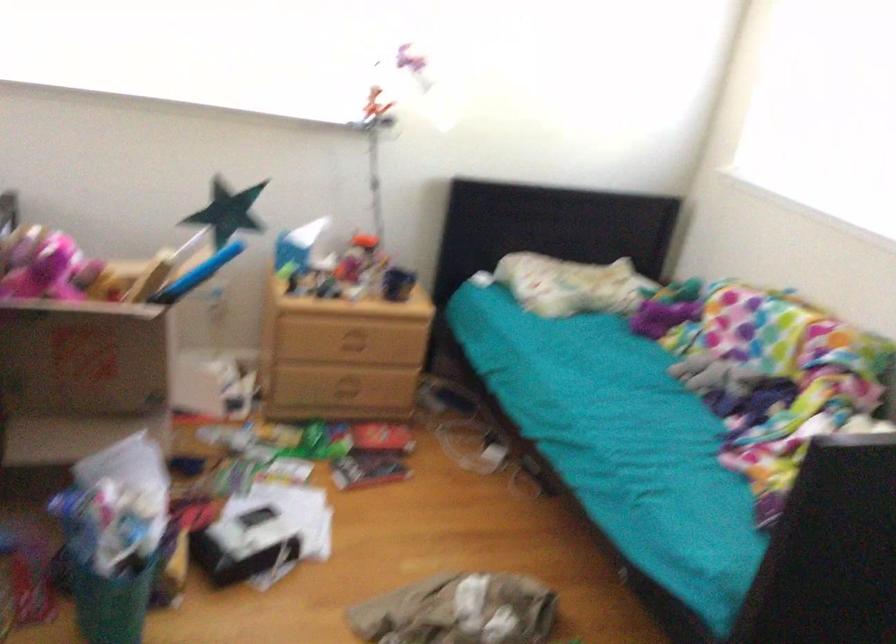
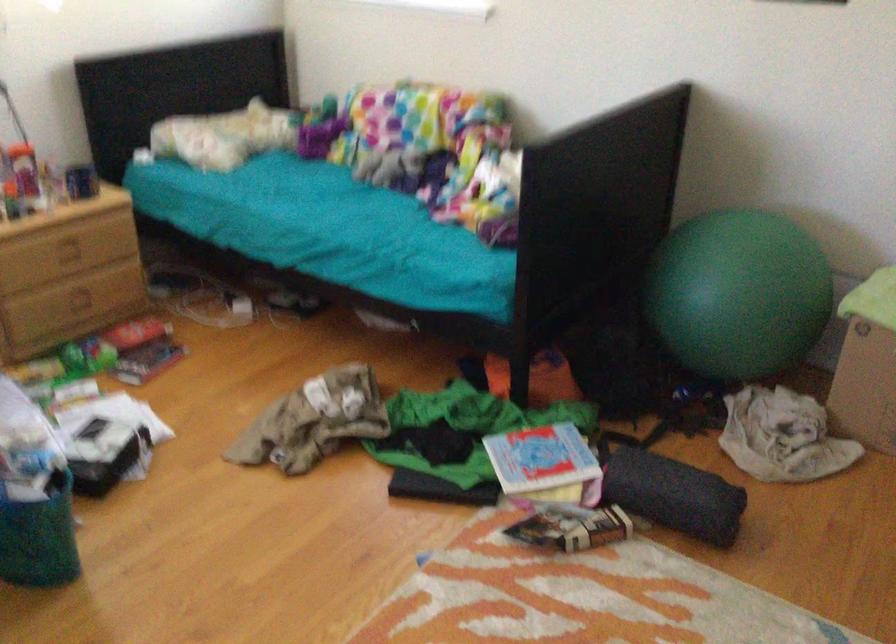
Question: The camera is either moving clockwise (left) or counter-clockwise (right) around the object. The first image is from the beginning of the video and the second image is from the end. Is the camera moving left or right when shooting the video?

Choices:
 (A) Left
 (B) Right

Answer: (A)